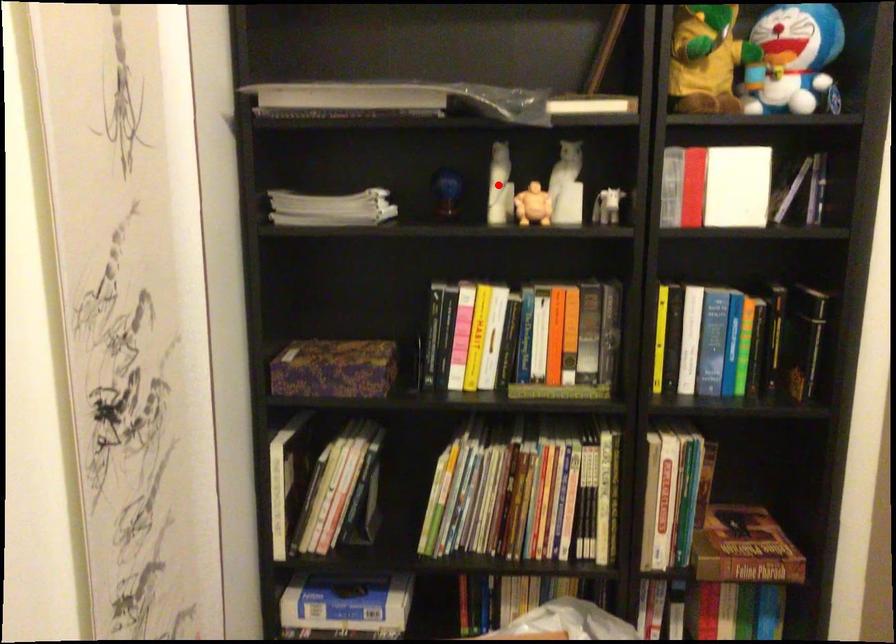
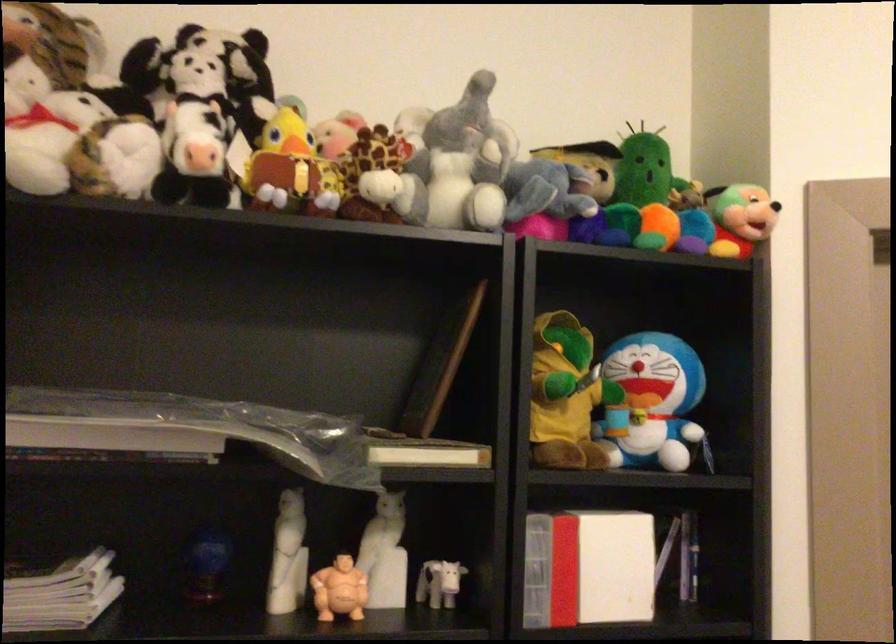
Question: A red point is marked in image1. In image2, is the corresponding 3D point closer to the camera or farther? Reply with the corresponding letter.

Choices:
 (A) The corresponding 3D point is closer.
 (B) The corresponding 3D point is farther.

Answer: (A)